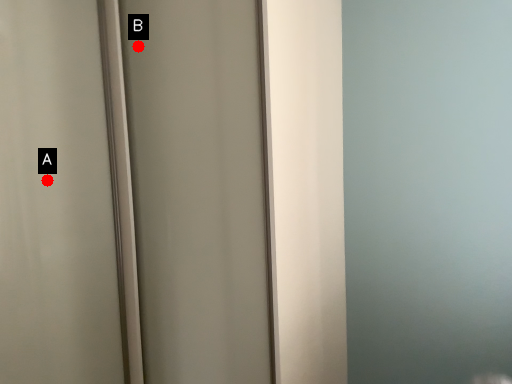
Question: Two points are circled on the image, labeled by A and B beside each circle. Which point is farther from the camera taking this photo?

Choices:
 (A) A is further
 (B) B is further

Answer: (B)